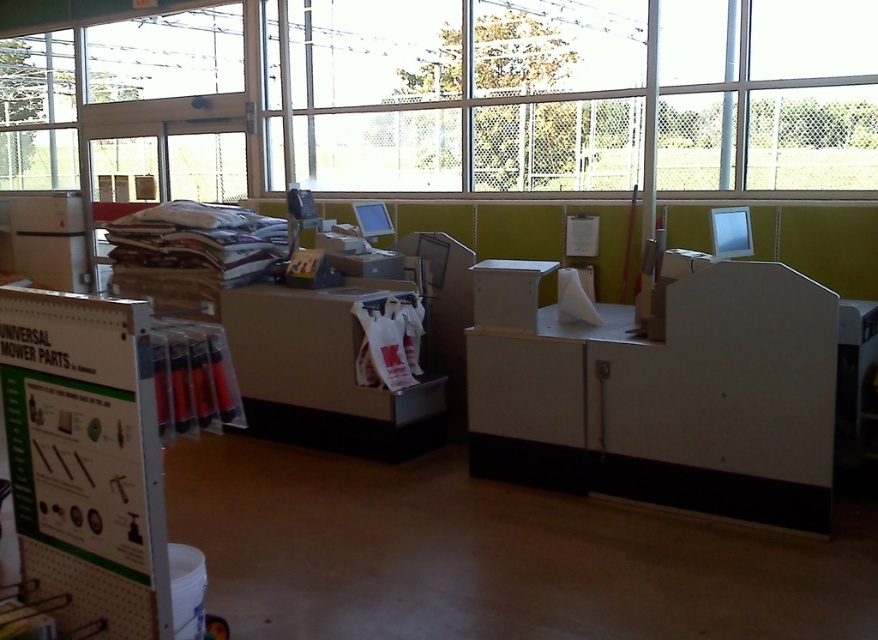
Question: Among these objects, which one is farthest from the camera?

Choices:
 (A) white matte box at center
 (B) satin silver monitor at upper right
 (C) white paper bag at center
 (D) white paper at upper left

Answer: (D)

Question: Which object is closer to the camera taking this photo?

Choices:
 (A) white paper at upper left
 (B) white paper bag at center
 (C) satin silver monitor at upper right
 (D) white matte box at center

Answer: (C)

Question: Is white paper at upper left positioned before white matte box at center?

Choices:
 (A) yes
 (B) no

Answer: (B)

Question: Does white paper bag at center have a smaller size compared to satin silver monitor at upper right?

Choices:
 (A) yes
 (B) no

Answer: (B)

Question: Is white paper at upper left thinner than satin silver monitor at upper right?

Choices:
 (A) yes
 (B) no

Answer: (B)

Question: Which of the following is the closest to the observer?

Choices:
 (A) white paper bag at center
 (B) satin silver monitor at upper right
 (C) white matte box at center

Answer: (B)